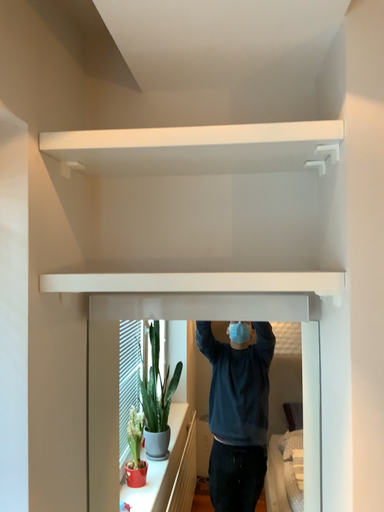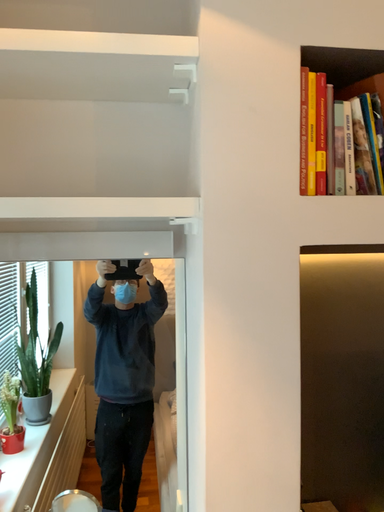
Question: How did the camera likely rotate when shooting the video?

Choices:
 (A) rotated left
 (B) rotated right

Answer: (B)